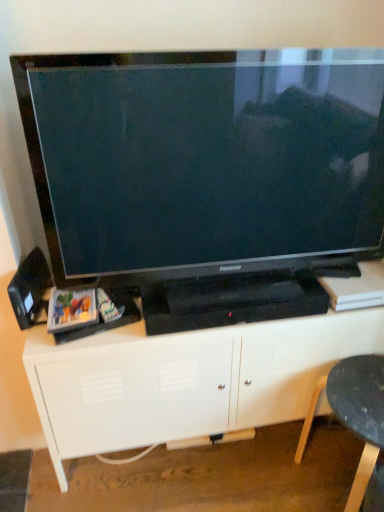
Question: Does black glossy television at center have a lesser height compared to black plastic speaker at left?

Choices:
 (A) no
 (B) yes

Answer: (A)

Question: Does black glossy television at center have a greater height compared to black plastic speaker at left?

Choices:
 (A) no
 (B) yes

Answer: (B)

Question: Does black glossy television at center have a lesser width compared to black plastic speaker at left?

Choices:
 (A) yes
 (B) no

Answer: (B)

Question: Is black glossy television at center positioned beyond the bounds of black plastic speaker at left?

Choices:
 (A) yes
 (B) no

Answer: (A)

Question: Is black glossy television at center to the left of black plastic speaker at left from the viewer's perspective?

Choices:
 (A) no
 (B) yes

Answer: (A)

Question: Can you confirm if black glossy television at center is positioned to the right of black plastic speaker at left?

Choices:
 (A) no
 (B) yes

Answer: (B)

Question: Is black plastic chair at lower right to the left of black glossy television at center from the viewer's perspective?

Choices:
 (A) no
 (B) yes

Answer: (A)

Question: From a real-world perspective, is black plastic chair at lower right physically below black glossy television at center?

Choices:
 (A) yes
 (B) no

Answer: (A)

Question: Is black plastic chair at lower right not inside black glossy television at center?

Choices:
 (A) yes
 (B) no

Answer: (A)

Question: Is black glossy television at center located within black plastic chair at lower right?

Choices:
 (A) no
 (B) yes

Answer: (A)

Question: From the image's perspective, is black plastic chair at lower right located above black glossy television at center?

Choices:
 (A) yes
 (B) no

Answer: (B)

Question: Does black plastic chair at lower right have a smaller size compared to black glossy television at center?

Choices:
 (A) yes
 (B) no

Answer: (A)

Question: Is white matte entertainment center at center outside black plastic chair at lower right?

Choices:
 (A) yes
 (B) no

Answer: (A)